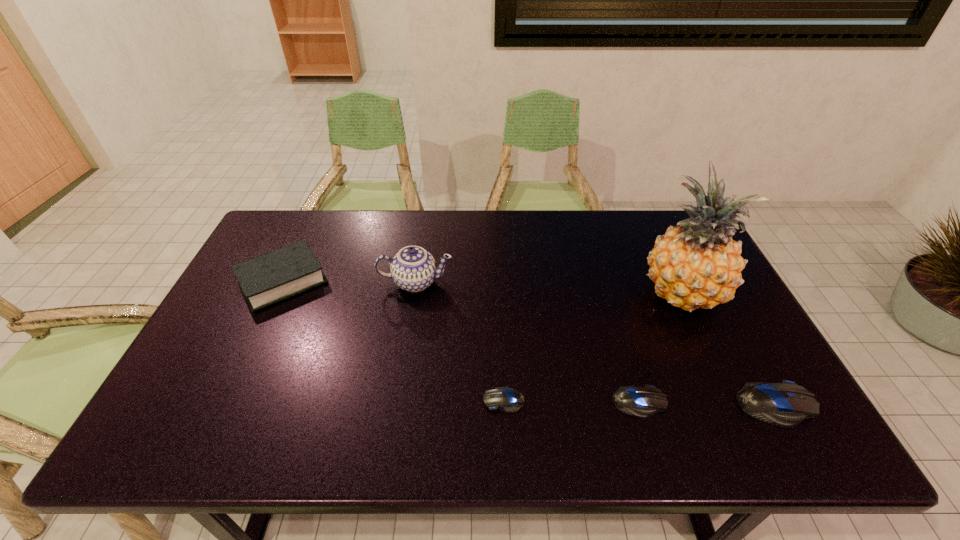
Image resolution: width=960 pixels, height=540 pixels. What are the coordinates of `the third tallest object` in the screenshot? It's located at (269, 278).

The image size is (960, 540). I want to click on free point located on the button side of the shortest object, so click(372, 400).

I want to click on free space located 0.180m on the button side of the shortest object, so pos(407,400).

Where is `vacant area situated 0.160m on the button side of the shortest object`? vacant area situated 0.160m on the button side of the shortest object is located at coordinates (416, 400).

You are a GUI agent. You are given a task and a screenshot of the screen. Output one action in this format:
    pyautogui.click(x=<x>, y=<y>)
    Task: Click on the free location located 0.110m on the button side of the second shortest computer mouse
    This screenshot has width=960, height=540.
    Given the screenshot: What is the action you would take?
    pyautogui.click(x=712, y=403)

Where is `vacant space located at the spout of the fifth object from right to left`? vacant space located at the spout of the fifth object from right to left is located at coordinates (405, 350).

In order to click on vacant area situated on the front of the pineapple in this screenshot , I will do `click(710, 356)`.

Where is `free region located on the right of the leftmost object`? This screenshot has height=540, width=960. free region located on the right of the leftmost object is located at coordinates (x=401, y=281).

Find the location of a particular element. object at the left edge is located at coordinates (269, 278).

Where is `computer mouse located at the right edge`? This screenshot has height=540, width=960. computer mouse located at the right edge is located at coordinates (786, 404).